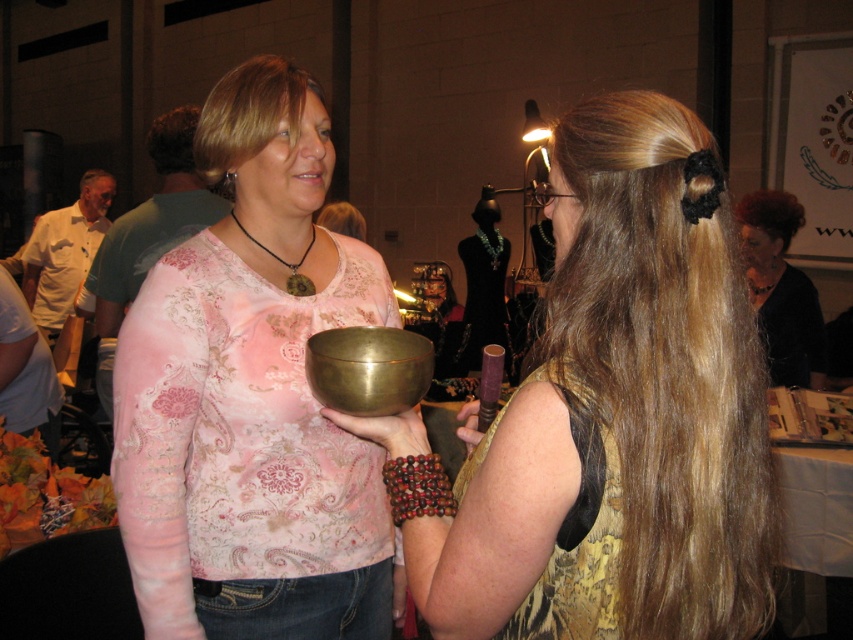
Is shiny black hair at upper right further to the viewer compared to blonde hair at upper center?

Yes.

What do you see at coordinates (781, 289) in the screenshot?
I see `shiny black hair at upper right` at bounding box center [781, 289].

In order to click on shiny black hair at upper right in this screenshot , I will do `click(781, 289)`.

Who is more distant from viewer, (409, 333) or (775, 227)?

Point (775, 227)

Can you confirm if brass/yellow metal bowl at center is wider than dark red hair at upper right?

In fact, brass/yellow metal bowl at center might be narrower than dark red hair at upper right.

Which is in front, point (323, 348) or point (758, 214)?

Point (323, 348) is in front.

At what (x,y) coordinates should I click in order to perform the action: click on brass/yellow metal bowl at center. Please return your answer as a coordinate pair (x, y). The image size is (853, 640). Looking at the image, I should click on (368, 369).

Can you confirm if brass/yellow metal bowl at center is smaller than blondehair at upper left?

Indeed, brass/yellow metal bowl at center has a smaller size compared to blondehair at upper left.

Is point (369, 413) behind point (202, 120)?

No.

This screenshot has height=640, width=853. I want to click on brass/yellow metal bowl at center, so click(x=368, y=369).